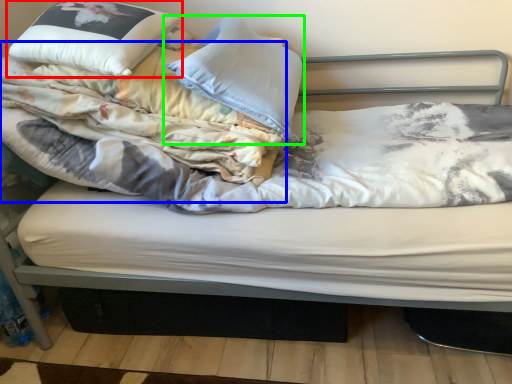
Question: Considering the real-world distances, which object is closest to pillow (highlighted by a red box)? blanket (highlighted by a blue box) or pillow (highlighted by a green box).

Choices:
 (A) blanket
 (B) pillow

Answer: (A)